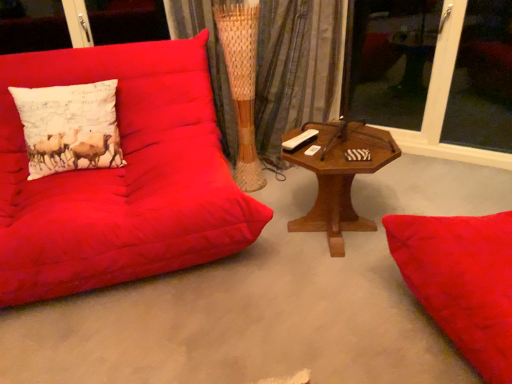
In order to click on free point in front of woodenobject at center in this screenshot , I will do `click(334, 297)`.